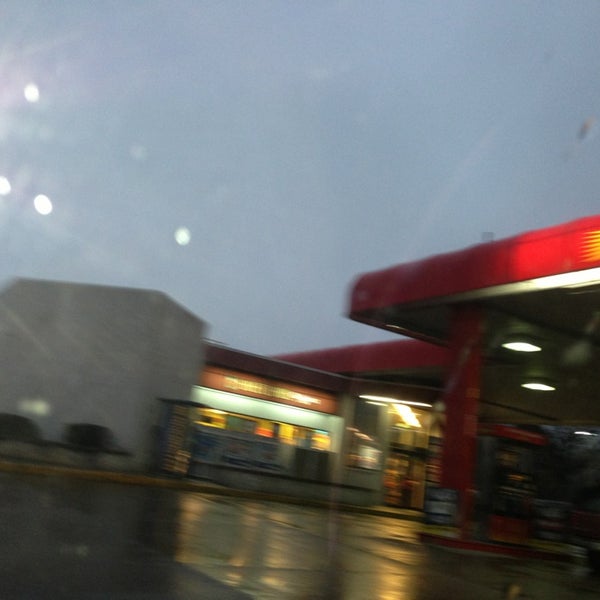
Identify the location of light. (543, 387).